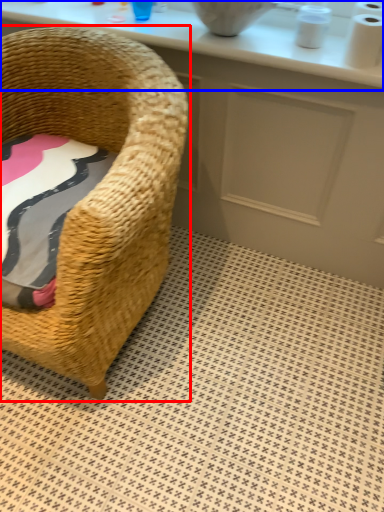
Question: Which point is closer to the camera, chair (highlighted by a red box) or counter top (highlighted by a blue box)?

Choices:
 (A) chair
 (B) counter top

Answer: (A)